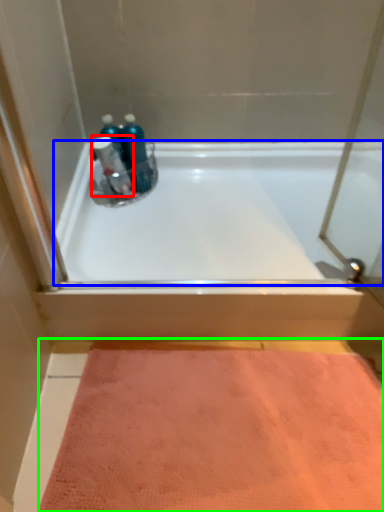
Question: Based on their relative distances, which object is farther from cleaning product (highlighted by a red box)? Choose from bathtub (highlighted by a blue box) and doormat (highlighted by a green box).

Choices:
 (A) bathtub
 (B) doormat

Answer: (B)